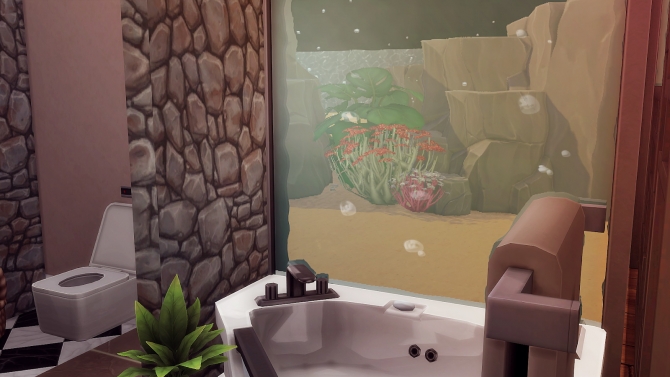
This screenshot has width=670, height=377. In order to click on black and white checkered floor in this screenshot , I will do `click(76, 284)`, `click(38, 355)`.